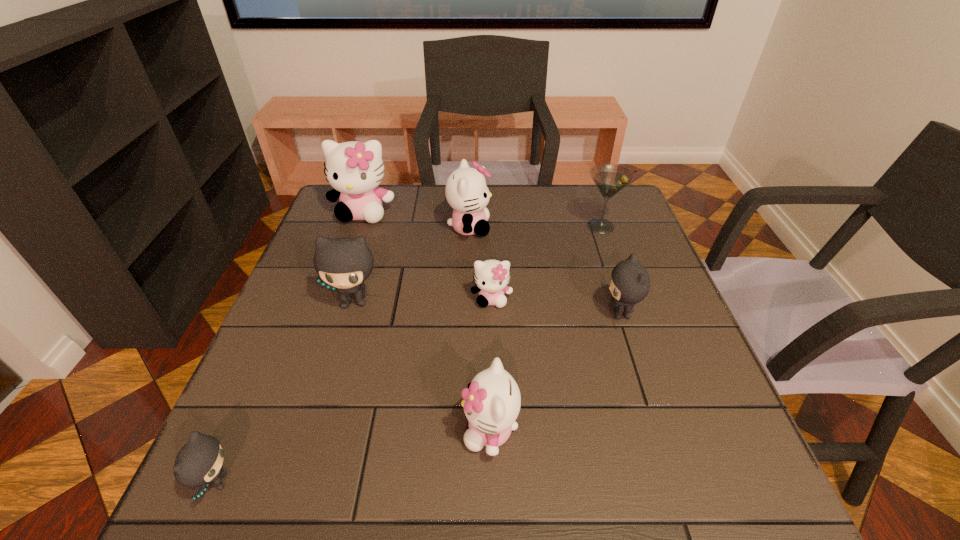
Identify the location of vacant space at the near edge. Image resolution: width=960 pixels, height=540 pixels. (441, 472).

What are the coordinates of `free space at the left edge of the desktop` in the screenshot? It's located at (300, 408).

In the image, there is a desktop. What are the coordinates of `vacant space at the right edge` in the screenshot? It's located at (645, 388).

Where is `free region at the far left corner of the desktop`? free region at the far left corner of the desktop is located at coordinates (368, 225).

Locate an element on the screen. Image resolution: width=960 pixels, height=540 pixels. vacant space at the near right corner is located at coordinates (763, 485).

The height and width of the screenshot is (540, 960). Identify the location of free space between the third biggest white kitten and the second gray kitten from left to right. (422, 366).

Where is `unoccupied area between the biggest white kitten and the smallest gray kitten`? unoccupied area between the biggest white kitten and the smallest gray kitten is located at coordinates (290, 347).

Where is `free point between the nearest white kitten and the tallest kitten`? The width and height of the screenshot is (960, 540). free point between the nearest white kitten and the tallest kitten is located at coordinates (426, 321).

Image resolution: width=960 pixels, height=540 pixels. What are the coordinates of `empty location between the second biggest white kitten and the third biggest white kitten` in the screenshot? It's located at (480, 329).

Where is `free space between the smallest gray kitten and the second gray kitten from right to left`? free space between the smallest gray kitten and the second gray kitten from right to left is located at coordinates (286, 392).